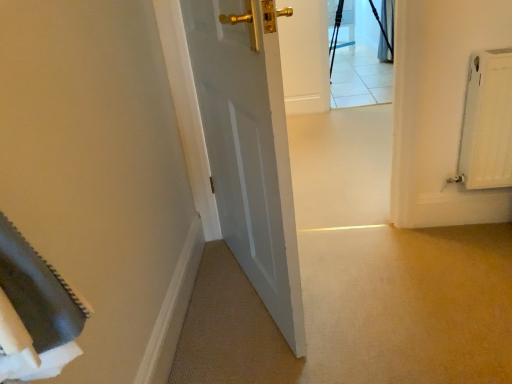
Question: In the image, is black fabric curtain at upper right positioned in front of or behind matte black chair at upper center?

Choices:
 (A) front
 (B) behind

Answer: (A)

Question: In terms of size, does black fabric curtain at upper right appear bigger or smaller than matte black chair at upper center?

Choices:
 (A) small
 (B) big

Answer: (A)

Question: In terms of width, does black fabric curtain at upper right look wider or thinner when compared to matte black chair at upper center?

Choices:
 (A) thin
 (B) wide

Answer: (A)

Question: In the image, is matte black chair at upper center positioned in front of or behind black fabric curtain at upper right?

Choices:
 (A) behind
 (B) front

Answer: (A)

Question: Considering the positions of matte black chair at upper center and black fabric curtain at upper right in the image, is matte black chair at upper center taller or shorter than black fabric curtain at upper right?

Choices:
 (A) tall
 (B) short

Answer: (B)

Question: Considering the positions of matte black chair at upper center and black fabric curtain at upper right in the image, is matte black chair at upper center wider or thinner than black fabric curtain at upper right?

Choices:
 (A) wide
 (B) thin

Answer: (A)

Question: From the image's perspective, is matte black chair at upper center above or below black fabric curtain at upper right?

Choices:
 (A) below
 (B) above

Answer: (B)